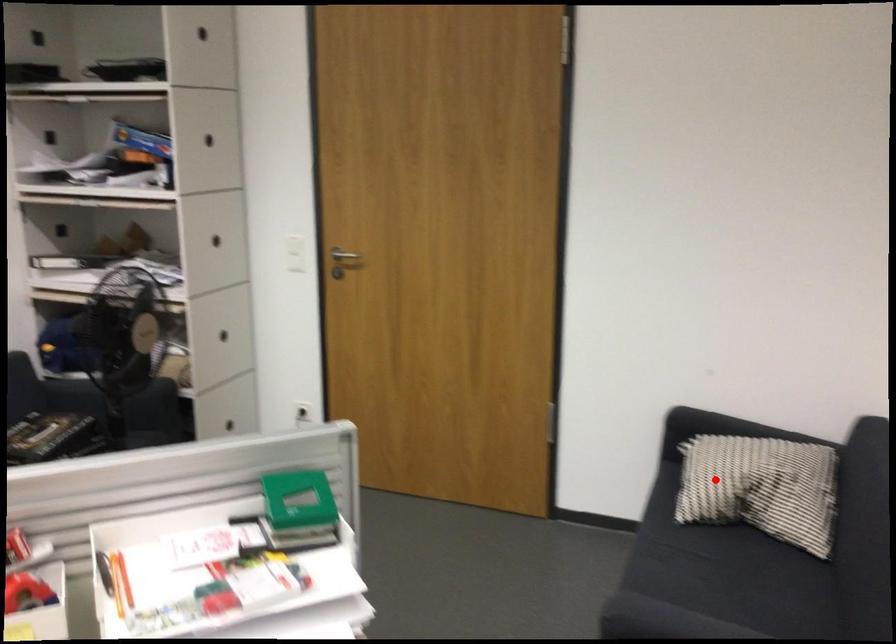
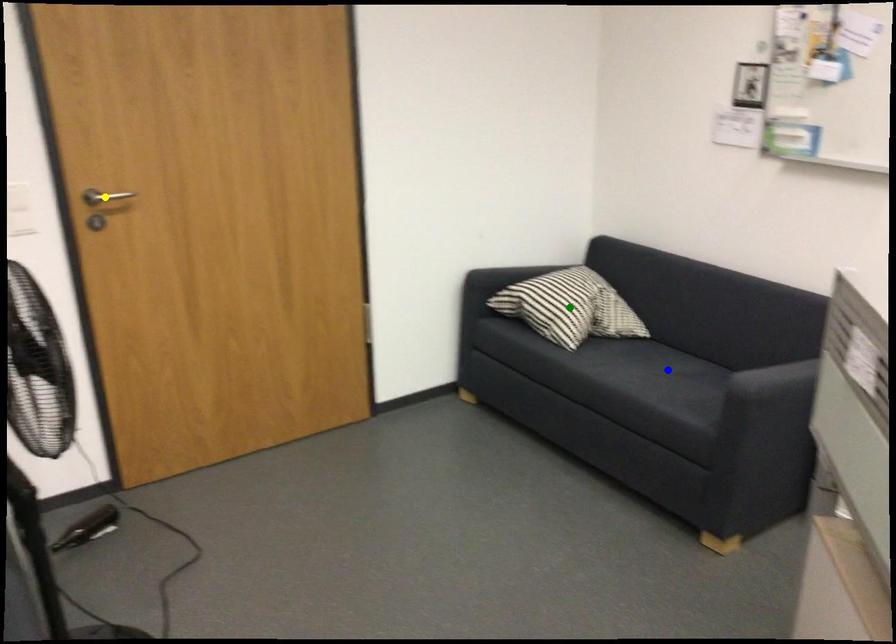
Question: I am providing you with two images of the same scene from different viewpoints. A red point is marked on the first image. You are given multiple points on the second image. Can you choose the point in image 2 that corresponds to the point in image 1?

Choices:
 (A) green point
 (B) yellow point
 (C) blue point

Answer: (A)